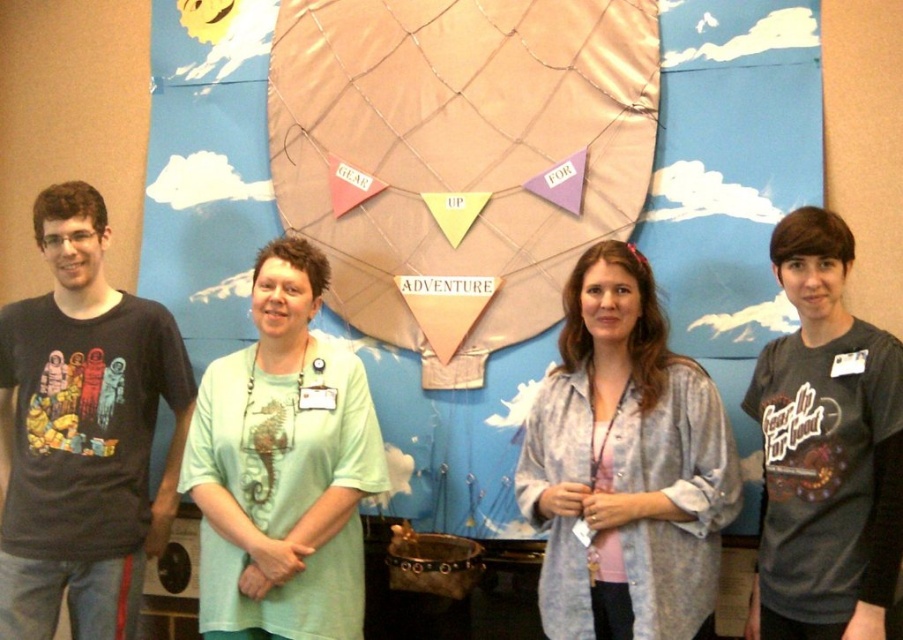
Question: Based on their relative distances, which object is nearer to the light green fabric shirt at center?

Choices:
 (A) pink fabric balloon at center
 (B) light blue sheer shirt at center
 (C) dark gray t-shirt at right

Answer: (A)

Question: Is light green fabric shirt at center thinner than dark gray t-shirt at right?

Choices:
 (A) yes
 (B) no

Answer: (B)

Question: Which object appears closest to the camera in this image?

Choices:
 (A) dark gray t-shirt at right
 (B) light green fabric shirt at center

Answer: (A)

Question: Which object is positioned closest to the light blue sheer shirt at center?

Choices:
 (A) pink fabric balloon at center
 (B) dark gray t-shirt at right
 (C) light green fabric shirt at center

Answer: (B)

Question: Does pink fabric balloon at center appear on the left side of dark gray t-shirt at right?

Choices:
 (A) no
 (B) yes

Answer: (B)

Question: Is pink fabric balloon at center thinner than dark gray t-shirt at right?

Choices:
 (A) no
 (B) yes

Answer: (A)